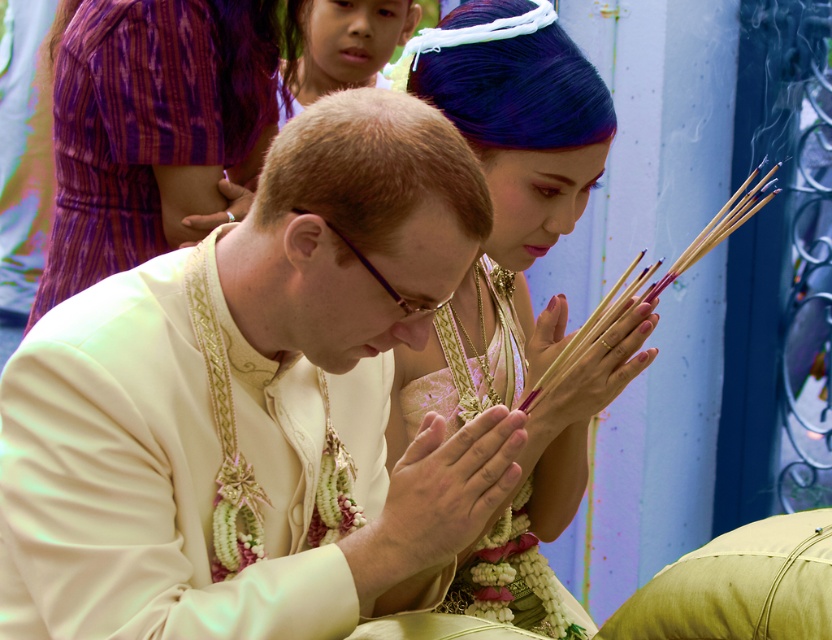
Question: Is matte cream suit at center below smooth wood incense sticks at center?

Choices:
 (A) no
 (B) yes

Answer: (B)

Question: Which of the following is the farthest from the observer?

Choices:
 (A) (600, 320)
 (B) (90, 225)
 (C) (526, 577)

Answer: (B)

Question: Among these points, which one is nearest to the camera?

Choices:
 (A) (494, 260)
 (B) (488, 477)
 (C) (156, 19)

Answer: (B)

Question: Can you confirm if matte gold necklace at center is positioned above wooden sticks at center?

Choices:
 (A) no
 (B) yes

Answer: (A)

Question: Which of these objects is positioned farthest from the matte yellow robe at left?

Choices:
 (A) smooth skin hands at center
 (B) silky white dress at center
 (C) matte gold necklace at center
 (D) matte cream suit at center

Answer: (A)

Question: Can you confirm if matte gold necklace at center is bigger than silky white dress at center?

Choices:
 (A) no
 (B) yes

Answer: (B)